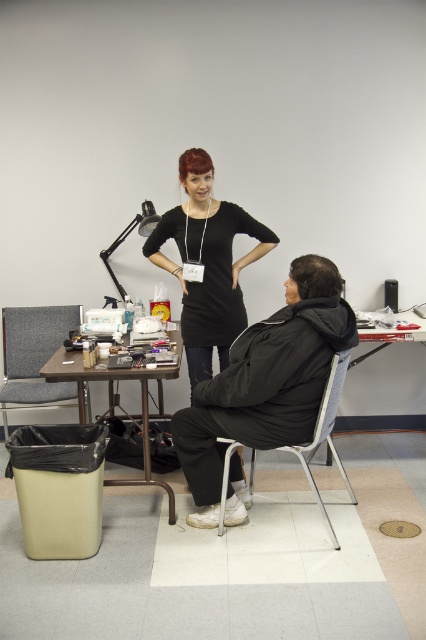
Where is the matte black jacket at center located in the image?

The matte black jacket at center is located at point coordinates of (265,381).

You are a stagehand who needs to place a large prop that requires a sturdy surface. You see the metallic silver table at lower left and the dark brown hair at right. Which object is more suitable for placing the prop?

The metallic silver table at lower left is larger in size than the dark brown hair at right, so the metallic silver table at lower left is more suitable for placing the prop since it has a larger surface area and is an object designed to hold items.

You are standing at the point marked as point (20, 369) in the image. You need to walk to the nearest exit, which is located 12 feet away from your current position. Can you reach the exit without moving more than 12 feet?

The distance between point (20, 369) and the viewer is 11.61 feet, which is less than 12 feet. Therefore, you can reach the exit without moving more than 12 feet.